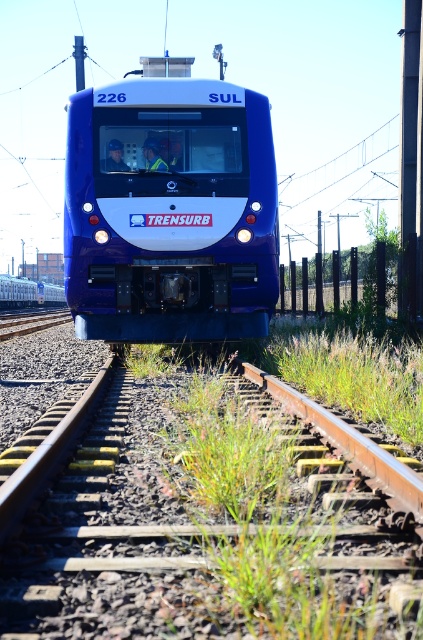
Does rusty metal train track at center appear over matte blue train at center?

No, rusty metal train track at center is not above matte blue train at center.

Is point (200, 579) less distant than point (180, 208)?

That is True.

Describe the element at coordinates (206, 516) in the screenshot. I see `rusty metal train track at center` at that location.

Find the location of `rusty metal train track at center`. rusty metal train track at center is located at coordinates (206, 516).